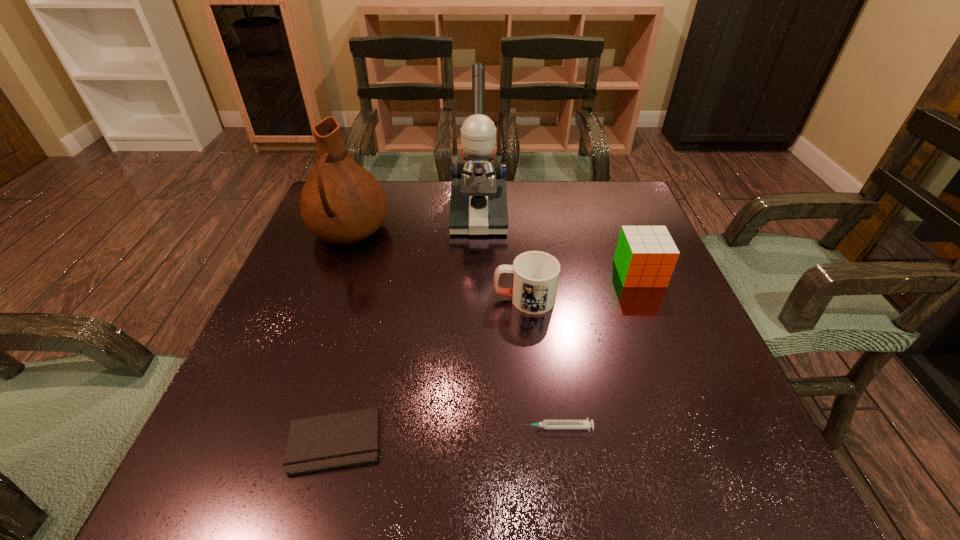
Locate an element on the screen. This screenshot has height=540, width=960. vacant point located on the side of the mug with the handle is located at coordinates (364, 299).

Locate an element on the screen. vacant space located 0.210m on the side of the mug with the handle is located at coordinates (396, 299).

You are a GUI agent. You are given a task and a screenshot of the screen. Output one action in this format:
    pyautogui.click(x=<x>, y=<y>)
    Task: Click on the vacant area located 0.180m at the needle end of the fifth tallest object
    
    Given the screenshot: What is the action you would take?
    pyautogui.click(x=410, y=428)

Identify the location of vacant space located at the needle end of the fifth tallest object. (392, 428).

Locate an element on the screen. free space located 0.370m at the needle end of the fifth tallest object is located at coordinates (295, 428).

You are a GUI agent. You are given a task and a screenshot of the screen. Output one action in this format:
    pyautogui.click(x=<x>, y=<y>)
    Task: Click on the vacant region located on the right of the shortest object
    The width and height of the screenshot is (960, 540).
    Given the screenshot: What is the action you would take?
    pyautogui.click(x=573, y=441)

This screenshot has height=540, width=960. I want to click on microscope that is at the far edge, so click(478, 204).

Identify the location of pitcher that is at the far edge. The image size is (960, 540). (341, 202).

At what (x,y) coordinates should I click in order to perform the action: click on object present at the near edge. Please return your answer as a coordinate pair (x, y). The image size is (960, 540). Looking at the image, I should click on (337, 440).

At what (x,y) coordinates should I click in order to perform the action: click on pitcher at the left edge. Please return your answer as a coordinate pair (x, y). The image size is (960, 540). Looking at the image, I should click on (341, 202).